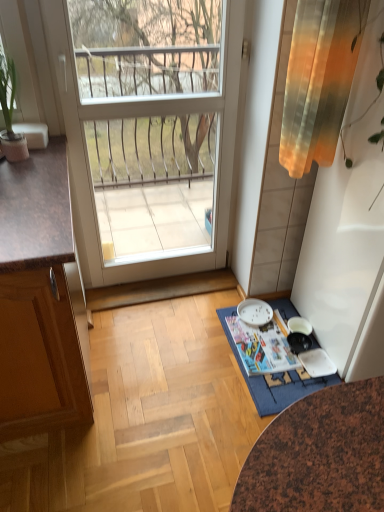
Where is `free space underneath white glossy door at center (from a real-world perspective)`? free space underneath white glossy door at center (from a real-world perspective) is located at coordinates (160, 282).